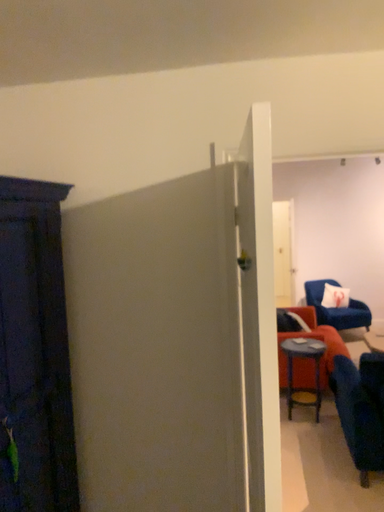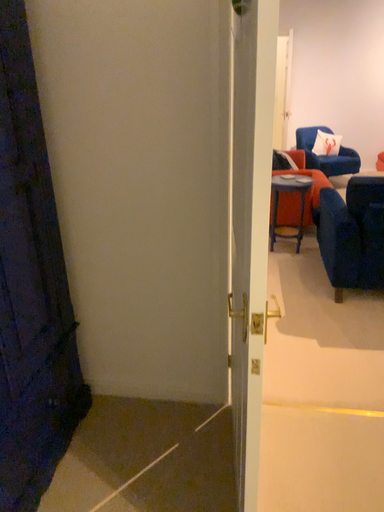
Question: Which way did the camera rotate in the video?

Choices:
 (A) rotated downward
 (B) rotated upward

Answer: (A)